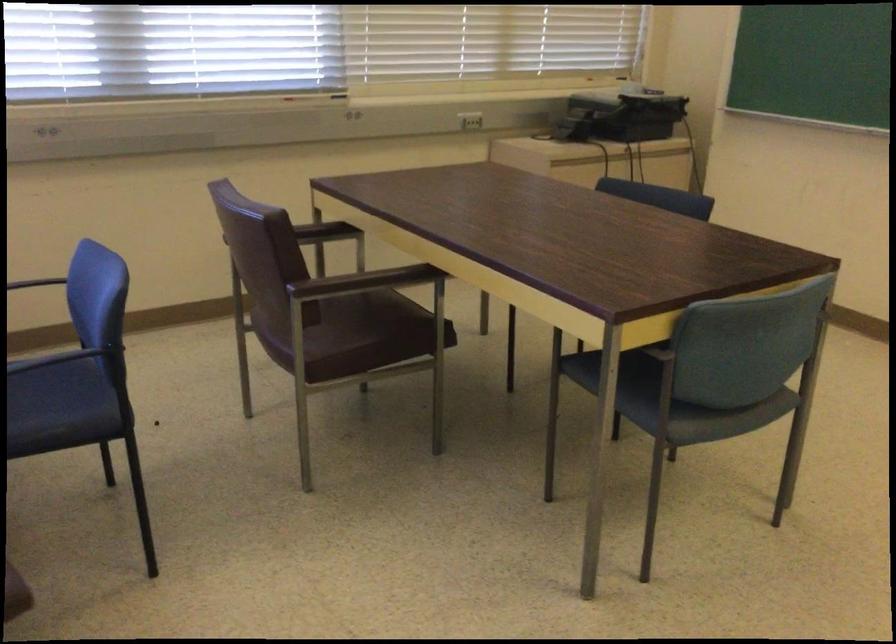
The image size is (896, 644). I want to click on blue fabric sitting surface, so click(625, 384).